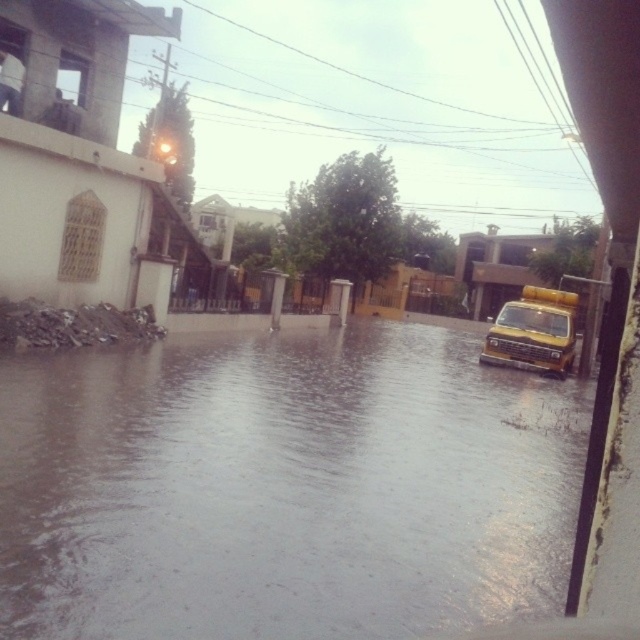
This screenshot has height=640, width=640. Describe the element at coordinates (284, 486) in the screenshot. I see `brown/muddy water at lower center` at that location.

Is the position of brown/muddy water at lower center less distant than that of yellow matte truck at right?

Yes, it is.

Is point (577, 380) behind point (557, 301)?

No, (577, 380) is closer to viewer.

I want to click on brown/muddy water at lower center, so click(284, 486).